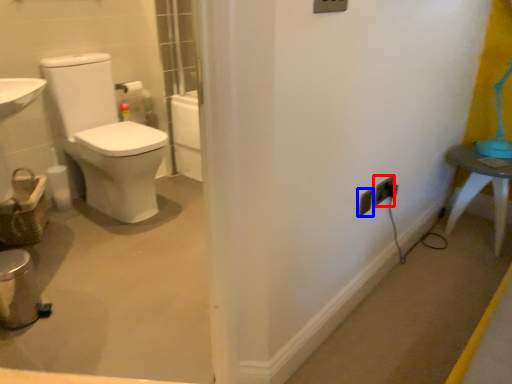
Question: Which point is closer to the camera, electric outlet (highlighted by a red box) or electric outlet (highlighted by a blue box)?

Choices:
 (A) electric outlet
 (B) electric outlet

Answer: (B)